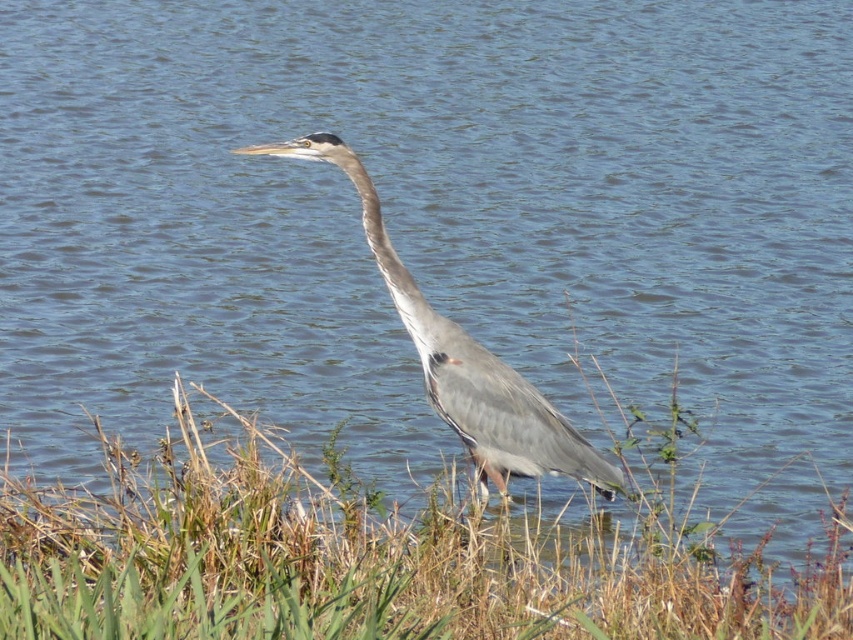
Image resolution: width=853 pixels, height=640 pixels. I want to click on gray matte heron at center, so click(463, 362).

Between point (361, 180) and point (364, 186), which one is positioned in front?

Point (361, 180)

Does point (585, 456) come closer to viewer compared to point (383, 257)?

No, (585, 456) is behind (383, 257).

Where is `gray matte heron at center`? The height and width of the screenshot is (640, 853). gray matte heron at center is located at coordinates (463, 362).

Which is above, green grass at lower center or gray matte heron at center?

Positioned higher is gray matte heron at center.

Does green grass at lower center have a lesser height compared to gray matte heron at center?

Yes.

Where is `green grass at lower center`? Image resolution: width=853 pixels, height=640 pixels. green grass at lower center is located at coordinates (370, 560).

Identify the location of green grass at lower center. Image resolution: width=853 pixels, height=640 pixels. (370, 560).

From the picture: Does green grass at lower center appear under gray matte neck at center?

Indeed, green grass at lower center is positioned under gray matte neck at center.

Can you confirm if green grass at lower center is taller than gray matte neck at center?

Indeed, green grass at lower center has a greater height compared to gray matte neck at center.

What do you see at coordinates (370, 560) in the screenshot? Image resolution: width=853 pixels, height=640 pixels. I see `green grass at lower center` at bounding box center [370, 560].

This screenshot has width=853, height=640. In order to click on green grass at lower center in this screenshot , I will do `click(370, 560)`.